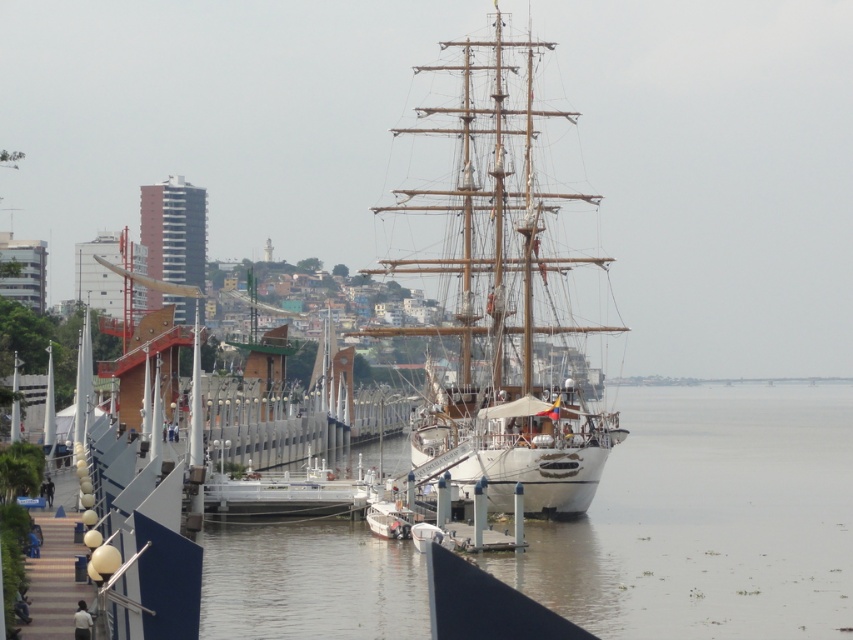
Question: Is brown murky water at center positioned at the back of wooden ship at center?

Choices:
 (A) no
 (B) yes

Answer: (A)

Question: Is brown murky water at center positioned behind wooden ship at center?

Choices:
 (A) no
 (B) yes

Answer: (A)

Question: Which point is farther from the camera taking this photo?

Choices:
 (A) click(722, 609)
 (B) click(506, 280)

Answer: (B)

Question: Can you confirm if brown murky water at center is positioned to the left of wooden ship at center?

Choices:
 (A) no
 (B) yes

Answer: (A)

Question: Which object appears closest to the camera in this image?

Choices:
 (A) wooden ship at center
 (B) brown murky water at center

Answer: (B)